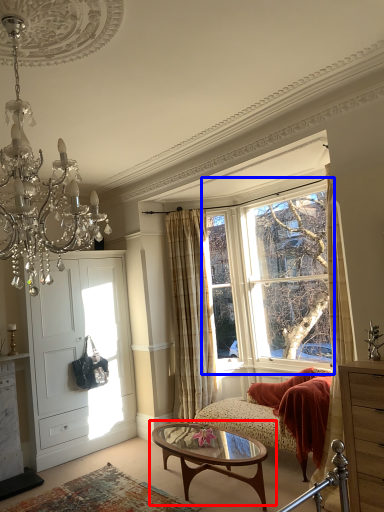
Question: Which object appears closest to the camera in this image, coffee table (highlighted by a red box) or window (highlighted by a blue box)?

Choices:
 (A) coffee table
 (B) window

Answer: (A)